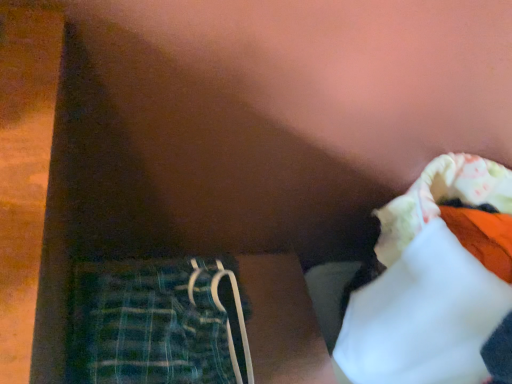
Question: From a real-world perspective, is green plaid fabric at lower left physically located above or below white fabric at upper right?

Choices:
 (A) above
 (B) below

Answer: (B)

Question: Visually, is green plaid fabric at lower left positioned to the left or to the right of white fabric at upper right?

Choices:
 (A) left
 (B) right

Answer: (A)

Question: Looking at the image, does green plaid fabric at lower left seem bigger or smaller compared to white fabric at upper right?

Choices:
 (A) small
 (B) big

Answer: (A)

Question: Does point (431, 271) appear closer or farther from the camera than point (156, 302)?

Choices:
 (A) farther
 (B) closer

Answer: (B)

Question: Considering the positions of white fabric at upper right and green plaid fabric at lower left in the image, is white fabric at upper right wider or thinner than green plaid fabric at lower left?

Choices:
 (A) wide
 (B) thin

Answer: (A)

Question: From the image's perspective, relative to green plaid fabric at lower left, is white fabric at upper right above or below?

Choices:
 (A) below
 (B) above

Answer: (B)

Question: Choose the correct answer: Is white fabric at upper right inside green plaid fabric at lower left or outside it?

Choices:
 (A) outside
 (B) inside

Answer: (A)